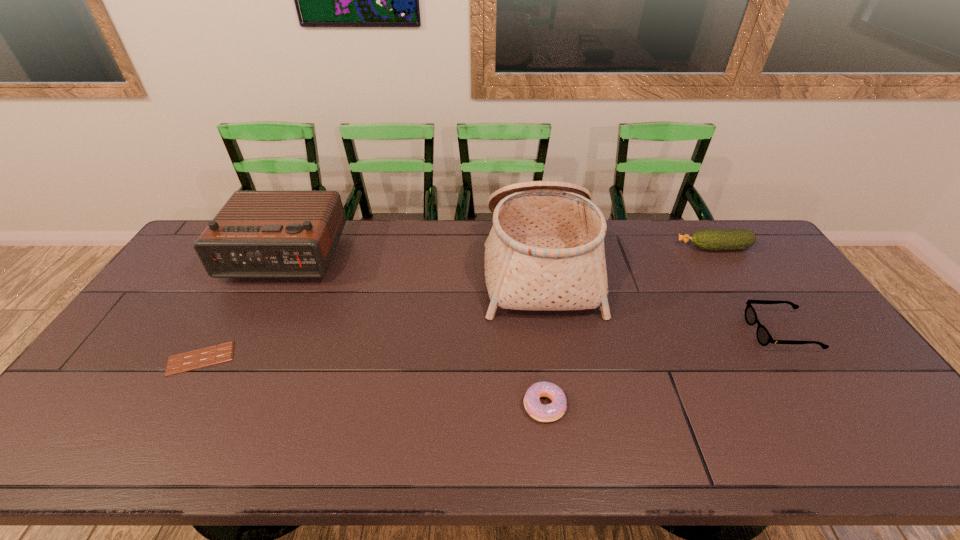
Locate an element on the screen. The width and height of the screenshot is (960, 540). vacant space located 0.380m on the tuning display of the second tallest object is located at coordinates (213, 390).

The height and width of the screenshot is (540, 960). Find the location of `free space located 0.210m at the blossom end of the fourth shortest object`. free space located 0.210m at the blossom end of the fourth shortest object is located at coordinates (617, 248).

Where is `free region located at the blossom end of the fourth shortest object`? free region located at the blossom end of the fourth shortest object is located at coordinates (637, 248).

Find the location of a particular element. The width and height of the screenshot is (960, 540). free space located 0.250m at the blossom end of the fourth shortest object is located at coordinates click(606, 248).

Identify the location of blank area located on the arms of the spectacles. (651, 332).

Where is `vacant area situated 0.080m on the arms of the spectacles`? This screenshot has height=540, width=960. vacant area situated 0.080m on the arms of the spectacles is located at coordinates (725, 332).

This screenshot has height=540, width=960. I want to click on vacant space located 0.210m on the arms of the spectacles, so click(679, 332).

Locate an element on the screen. vacant space located on the right of the doughnut is located at coordinates (590, 406).

At what (x,y) coordinates should I click in order to perform the action: click on vacant space located 0.330m on the right of the shortest object. Please return your answer as a coordinate pair (x, y). The height and width of the screenshot is (540, 960). Looking at the image, I should click on (356, 359).

Identify the location of basket positioned at the far edge. This screenshot has width=960, height=540. (545, 251).